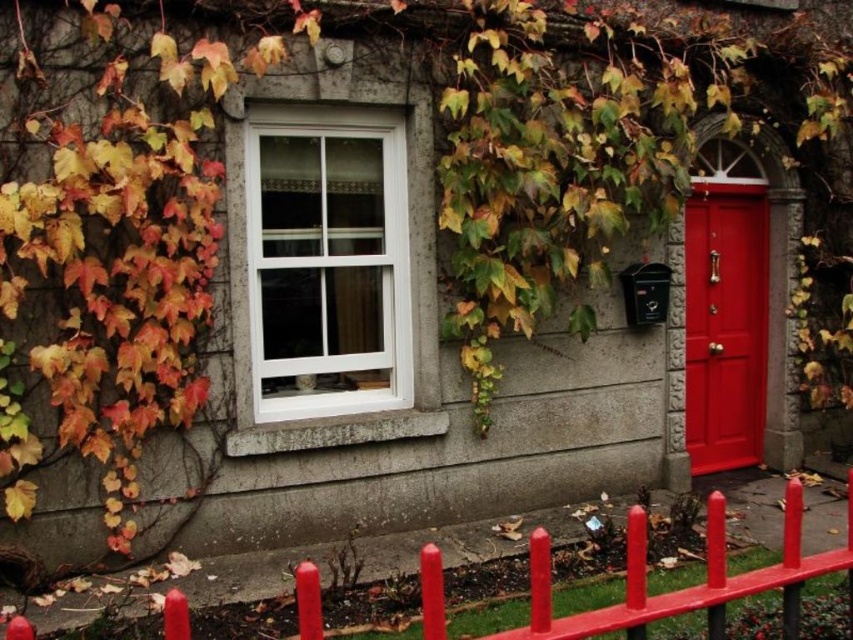
You are an architect designing a new house and want to ensure that the white plastic window at center and the smooth glossy fence at lower center are proportionate. Given that the fence needs to be wider than the window, does the current design meet this requirement?

Yes, the current design meets the requirement because the white plastic window at center is narrower than the smooth glossy fence at lower center, as stated in the description.

You are a painter who wants to paint the white plastic window at center and the smooth glossy fence at lower center. Which object requires more paint due to its size?

The white plastic window at center requires more paint because it is larger in size than the smooth glossy fence at lower center.